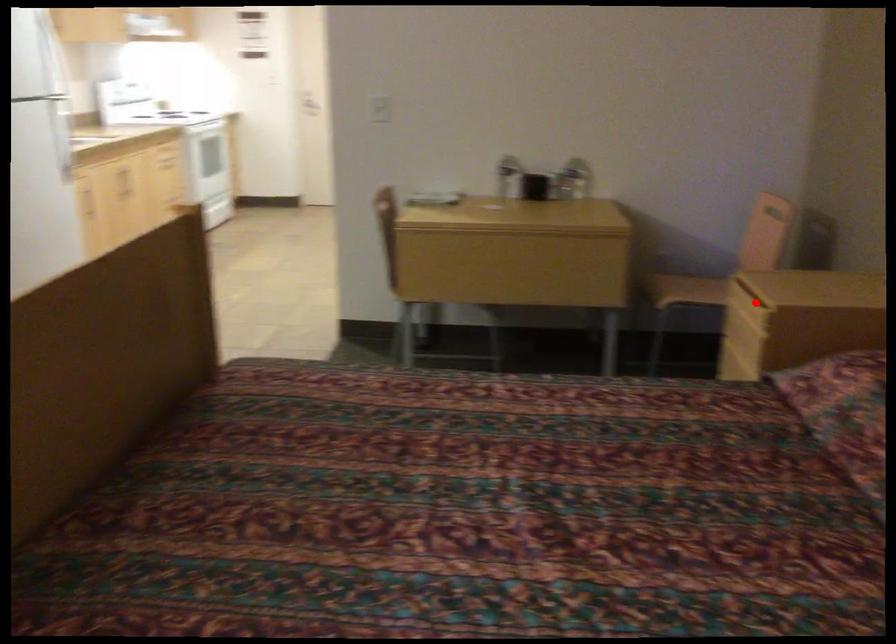
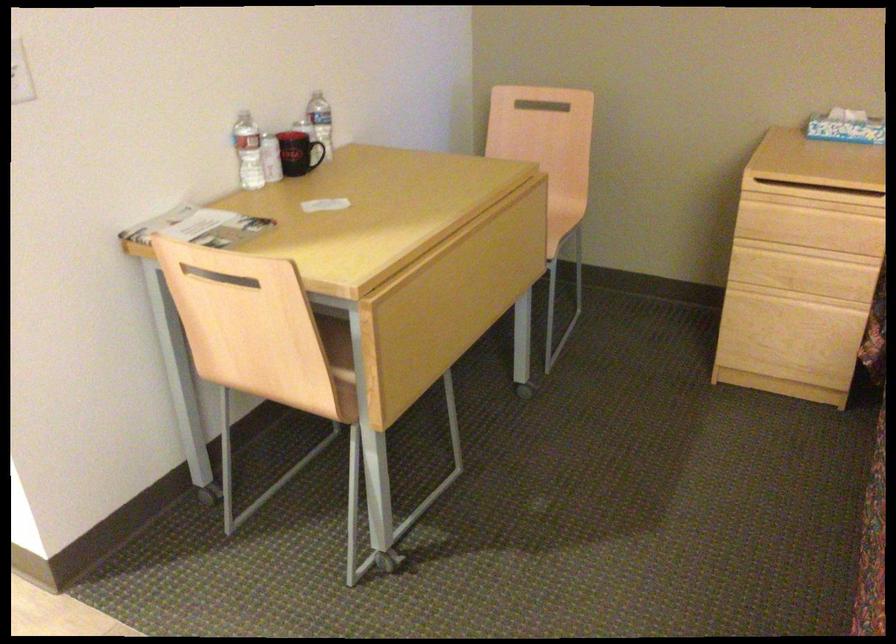
Find the pixel in the second image that matches the highlighted location in the first image.

(814, 196)